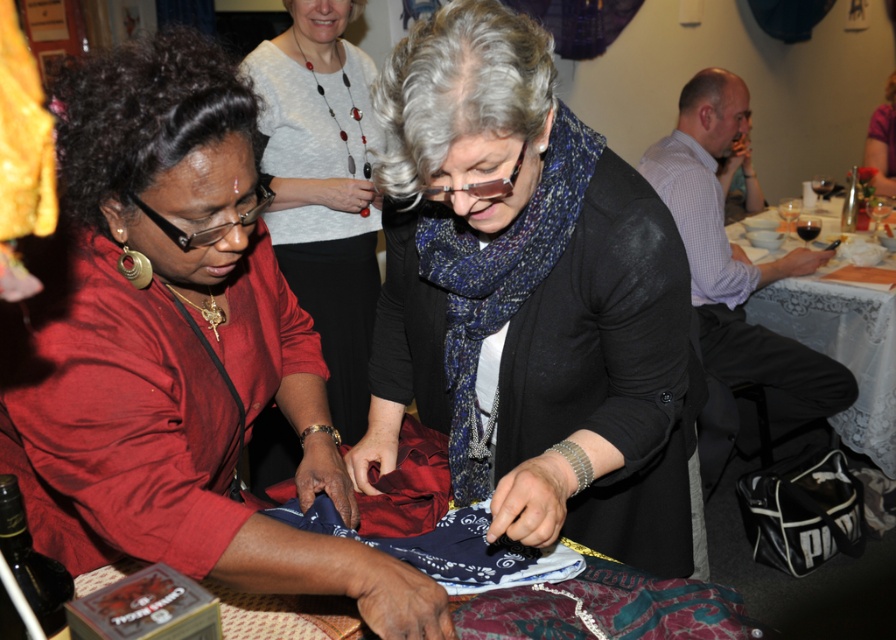
Looking at this image, does dark brown glass wine bottle at lower left lie in front of dark red glass at center?

Yes.

From the picture: Which of these two, dark brown glass wine bottle at lower left or dark red glass at center, stands shorter?

Standing shorter between the two is dark red glass at center.

Who is more distant from viewer, (x=10, y=531) or (x=800, y=221)?

Point (x=800, y=221)

This screenshot has height=640, width=896. What are the coordinates of `dark brown glass wine bottle at lower left` in the screenshot? It's located at (31, 561).

Is matte blue scarf at center below dark red glass at center?

Indeed, matte blue scarf at center is positioned under dark red glass at center.

Is matte blue scarf at center taller than dark red glass at center?

A: Correct, matte blue scarf at center is much taller as dark red glass at center.

Which is behind, point (648, 477) or point (816, 228)?

Positioned behind is point (816, 228).

Identify the location of matte blue scarf at center. (530, 296).

Does matte black sweater at center have a smaller size compared to purple fabric at upper right?

Correct, matte black sweater at center occupies less space than purple fabric at upper right.

Which is behind, point (358, 234) or point (886, 129)?

The point (886, 129) is behind.

Find the location of a particular element. The image size is (896, 640). matte black sweater at center is located at coordinates (323, 188).

Locate an element on the screen. The width and height of the screenshot is (896, 640). matte black sweater at center is located at coordinates (323, 188).